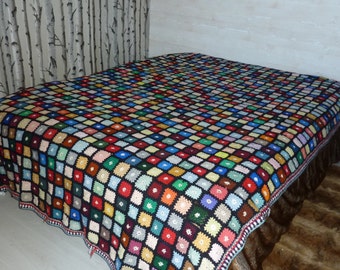
You are a GUI agent. You are given a task and a screenshot of the screen. Output one action in this format:
    pyautogui.click(x=<x>, y=<y>)
    Task: Click on the floor
    
    Given the screenshot: What is the action you would take?
    pyautogui.click(x=34, y=249)